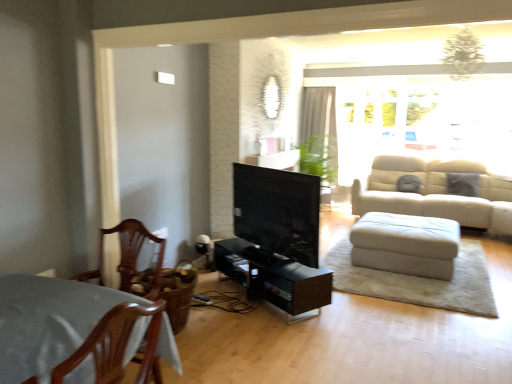
Question: From their relative heights in the image, would you say matte black tv at center is taller or shorter than white sheer curtain at upper center?

Choices:
 (A) short
 (B) tall

Answer: (A)

Question: Visually, is matte black tv at center positioned to the left or to the right of white sheer curtain at upper center?

Choices:
 (A) right
 (B) left

Answer: (B)

Question: Estimate the real-world distances between objects in this image. Which object is closer to the white leather footrest at lower right?

Choices:
 (A) black glossy entertainment center at center
 (B) translucent glass window at upper right
 (C) white sheer curtain at upper center
 (D) mahogany wood chair at left
 (E) matte black tv at center

Answer: (A)

Question: Estimate the real-world distances between objects in this image. Which object is closer to the black glossy entertainment center at center?

Choices:
 (A) mahogany wood chair at left
 (B) white leather footrest at lower right
 (C) white sheer curtain at upper center
 (D) translucent glass window at upper right
 (E) matte black tv at center

Answer: (E)